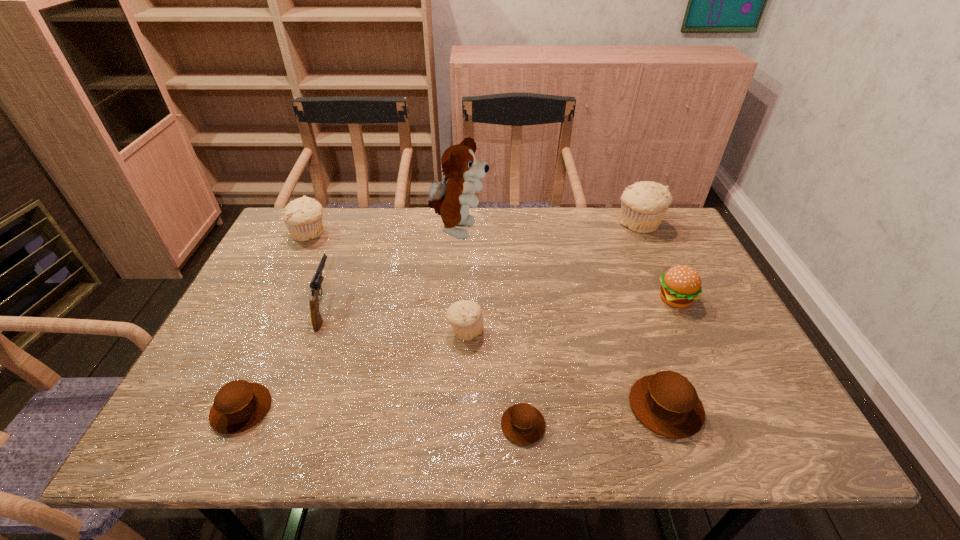
This screenshot has width=960, height=540. I want to click on object that is at the far left corner, so click(303, 216).

Where is `object that is positioned at the near left corner`? Image resolution: width=960 pixels, height=540 pixels. object that is positioned at the near left corner is located at coordinates (239, 405).

The height and width of the screenshot is (540, 960). I want to click on object present at the far right corner, so click(x=643, y=204).

Locate an element on the screen. vacant region at the far edge of the desktop is located at coordinates (410, 219).

Find the location of a particular element. vacant region at the near edge of the desktop is located at coordinates (389, 437).

Locate an element on the screen. vacant area at the left edge of the desktop is located at coordinates (276, 275).

This screenshot has height=540, width=960. In the image, there is a desktop. What are the coordinates of `free space at the right edge` in the screenshot? It's located at (653, 273).

Locate an element on the screen. The image size is (960, 540). vacant space at the far left corner is located at coordinates (280, 233).

I want to click on vacant space at the far right corner of the desktop, so point(648,248).

The width and height of the screenshot is (960, 540). Find the location of `free space that is in between the leftmost beige muffin and the leftmost brown muffin`. free space that is in between the leftmost beige muffin and the leftmost brown muffin is located at coordinates (276, 321).